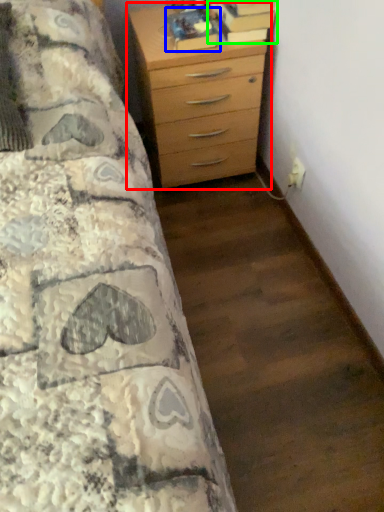
Question: Which is nearer to the chest of drawers (highlighted by a red box)? book (highlighted by a blue box) or book (highlighted by a green box).

Choices:
 (A) book
 (B) book

Answer: (A)